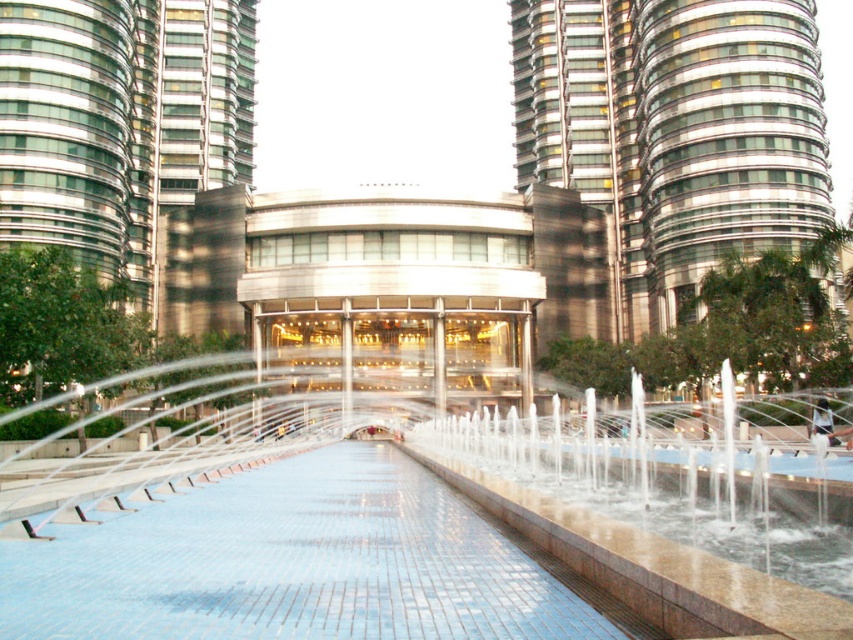
You are a drone operator tasked with flying a drone from the white glossy water at center to the glassy steel skyscraper at upper right. The drone has a maximum flight range of 50 meters. Based on the scene, can the drone reach its destination without needing to recharge?

The distance between the white glossy water at center and the glassy steel skyscraper at upper right is 50.42 meters, which exceeds the drone operator drone operator drone operator drone operator drone operator drone operator drone operator drone operator drone operator drone operator drone operator drone operator drone operator drone operator drone operator drone operator drone operator drone operator drone operator drone operator drone operator drone operator drone operator drone operator drone operator 5

You are standing in the plaza and want to walk to the entrance of the lower building. There are two points marked on the plaza. Which point is closer to you, point (x=148, y=376) or point (x=717, y=257)?

Point (x=148, y=376) is closer to the viewer than point (x=717, y=257), so the closer point is point (x=148, y=376).